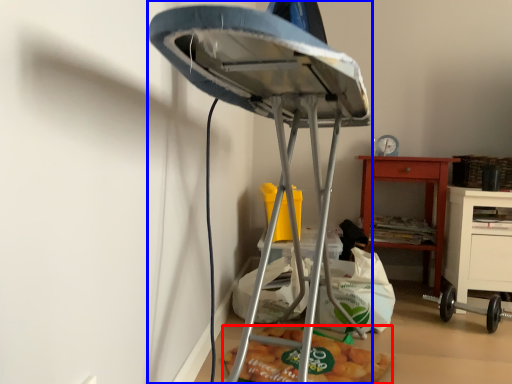
Question: Which of the following is the closest to the observer, food (highlighted by a red box) or furniture (highlighted by a blue box)?

Choices:
 (A) food
 (B) furniture

Answer: (B)